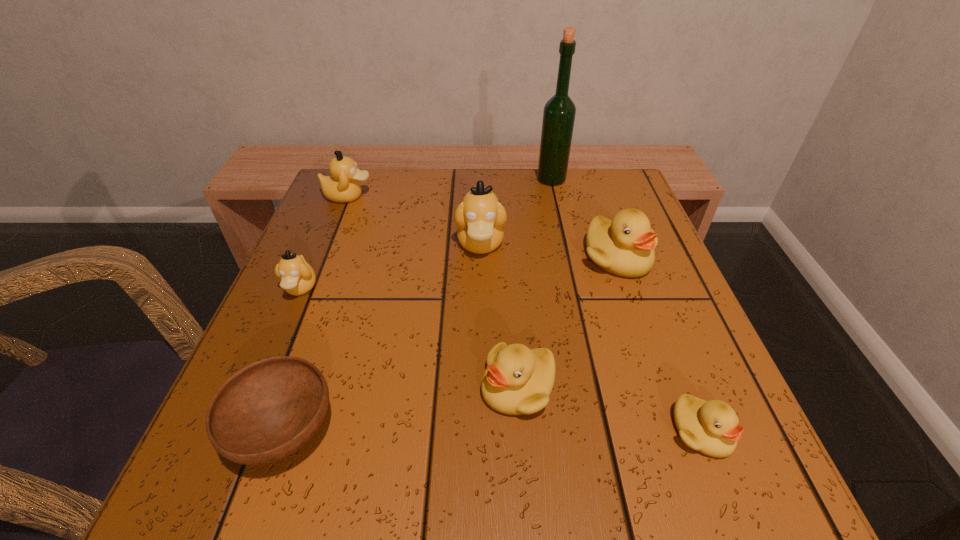
You are a GUI agent. You are given a task and a screenshot of the screen. Output one action in this format:
    pyautogui.click(x=<x>, y=<y>)
    Task: Click on the tallest object
    This screenshot has height=540, width=960.
    Given the screenshot: What is the action you would take?
    pyautogui.click(x=559, y=112)

Image resolution: width=960 pixels, height=540 pixels. I want to click on green liquor, so pos(559,112).

Identify the location of the tallest duckling. (480, 218).

This screenshot has height=540, width=960. Identify the location of the second farthest tan duckling. (480, 218).

You are a GUI agent. You are given a task and a screenshot of the screen. Output one action in this format:
    pyautogui.click(x=<x>, y=<y>)
    Task: Click on the second farthest object
    
    Given the screenshot: What is the action you would take?
    pyautogui.click(x=342, y=186)

The height and width of the screenshot is (540, 960). In order to click on the farthest duckling in this screenshot , I will do `click(342, 186)`.

Find the location of a particular element. The width and height of the screenshot is (960, 540). the farthest yellow duckling is located at coordinates tap(624, 246).

Where is `the second biggest yellow duckling`? The image size is (960, 540). the second biggest yellow duckling is located at coordinates (517, 380).

Find the location of `the smallest tan duckling`. the smallest tan duckling is located at coordinates (297, 277).

You are a GUI agent. You are given a task and a screenshot of the screen. Output one action in this format:
    pyautogui.click(x=<x>, y=<y>)
    Task: Click on the bowl
    
    Given the screenshot: What is the action you would take?
    pyautogui.click(x=266, y=411)